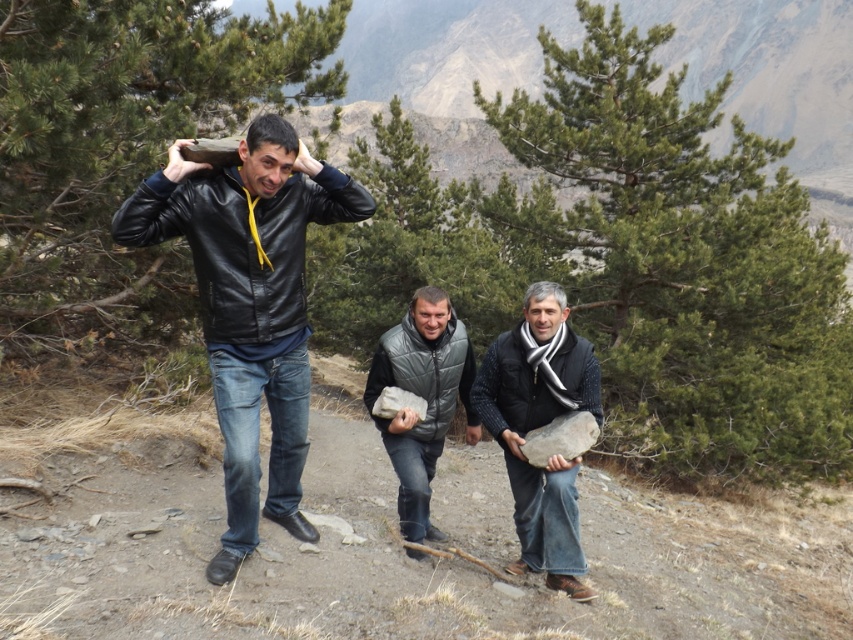
How far apart are black leather jacket at center and gray matte vest at center?

1.37 meters

In the scene shown: Which of these two, black leather jacket at center or gray matte vest at center, stands taller?

Standing taller between the two is black leather jacket at center.

Who is more distant from viewer, [293,285] or [431,376]?

Positioned behind is point [431,376].

Where is `black leather jacket at center`? This screenshot has height=640, width=853. black leather jacket at center is located at coordinates (248, 304).

Does dark gray wool sweater at center have a greater height compared to gray matte vest at center?

Yes, dark gray wool sweater at center is taller than gray matte vest at center.

Between dark gray wool sweater at center and gray matte vest at center, which one appears on the left side from the viewer's perspective?

From the viewer's perspective, gray matte vest at center appears more on the left side.

Does point (471, 394) come in front of point (440, 356)?

No, (471, 394) is behind (440, 356).

At what (x,y) coordinates should I click in order to perform the action: click on dark gray wool sweater at center. Please return your answer as a coordinate pair (x, y). The height and width of the screenshot is (640, 853). Looking at the image, I should click on (538, 426).

Measure the distance from black leather jacket at center to dark gray wool sweater at center.

They are 6.51 feet apart.

I want to click on black leather jacket at center, so click(x=248, y=304).

Find the location of a particular element. Image resolution: width=853 pixels, height=640 pixels. black leather jacket at center is located at coordinates (248, 304).